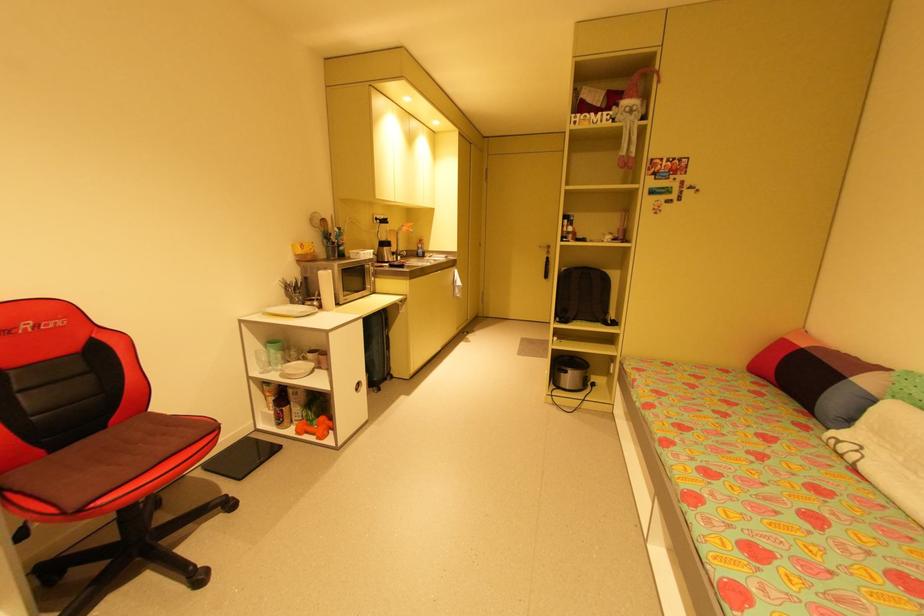
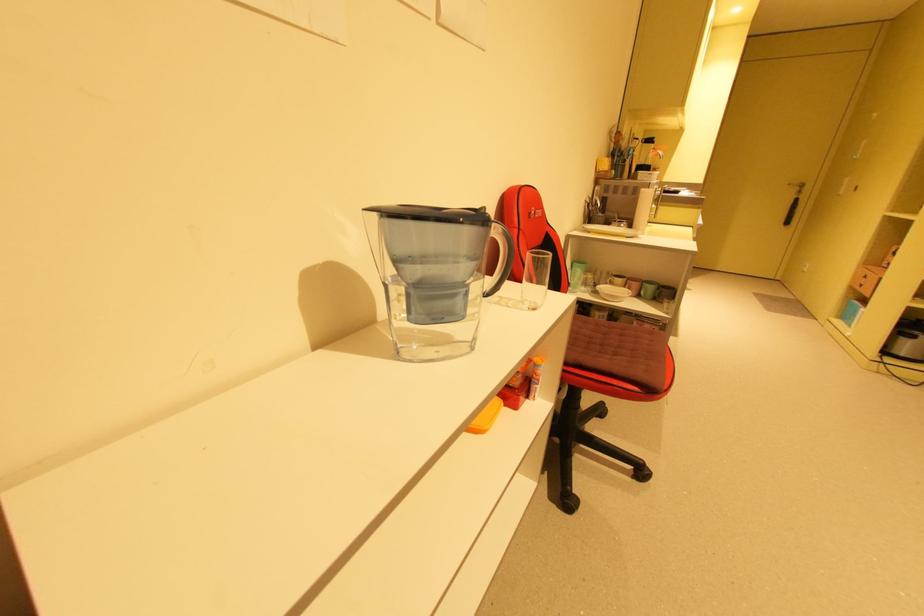
Question: In a continuous first-person perspective shot, in which direction is the camera moving?

Choices:
 (A) Left
 (B) Right
 (C) Forward
 (D) Backward

Answer: (A)